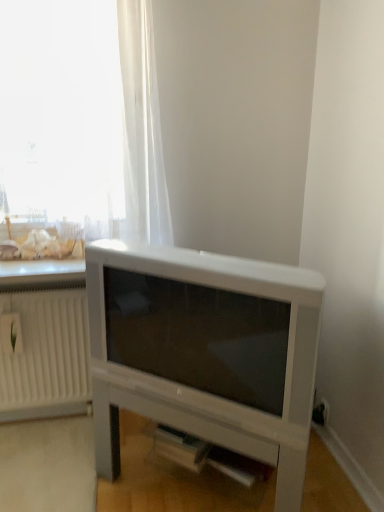
Where is `transparent fabric at upper left`? Image resolution: width=384 pixels, height=512 pixels. transparent fabric at upper left is located at coordinates (62, 113).

The image size is (384, 512). Identify the location of white matte entertainment center at lower center. (205, 352).

From the image's perspective, does white plastic radiator at left appear lower than transparent fabric at upper left?

Yes, from the image's perspective, white plastic radiator at left is beneath transparent fabric at upper left.

From a real-world perspective, is white plastic radiator at left on top of transparent fabric at upper left?

Actually, white plastic radiator at left is physically below transparent fabric at upper left in the real world.

Considering the positions of objects white plastic radiator at left and transparent fabric at upper left in the image provided, who is more to the right, white plastic radiator at left or transparent fabric at upper left?

transparent fabric at upper left.

Is white plastic radiator at left not close to transparent fabric at upper left?

No.

Can you tell me how much white plastic radiator at left and white matte entertainment center at lower center differ in facing direction?

37.5 degrees.

Is white plastic radiator at left closer to the viewer compared to white matte entertainment center at lower center?

No, the depth of white plastic radiator at left is greater than that of white matte entertainment center at lower center.

Is white plastic radiator at left taller than white matte entertainment center at lower center?

Correct, white plastic radiator at left is much taller as white matte entertainment center at lower center.

Is white plastic radiator at left to the right of white matte entertainment center at lower center from the viewer's perspective?

Incorrect, white plastic radiator at left is not on the right side of white matte entertainment center at lower center.

Would you say white matte entertainment center at lower center is outside white plastic radiator at left?

Yes.

Does point (120, 344) lie behind point (81, 411)?

No, (120, 344) is in front of (81, 411).

Would you say white matte entertainment center at lower center is a long distance from white plastic radiator at left?

No, white matte entertainment center at lower center is not far away from white plastic radiator at left.

Is transparent fabric at upper left to the left of white matte entertainment center at lower center from the viewer's perspective?

Yes, transparent fabric at upper left is to the left of white matte entertainment center at lower center.

How different are the orientations of transparent fabric at upper left and white matte entertainment center at lower center in degrees?

38.8 degrees separate the facing orientations of transparent fabric at upper left and white matte entertainment center at lower center.

Which is closer, [92,69] or [282,431]?

Clearly, point [92,69] is more distant from the camera than point [282,431].

Considering the relative positions of transparent fabric at upper left and white matte entertainment center at lower center in the image provided, is transparent fabric at upper left in front of white matte entertainment center at lower center?

No, the depth of transparent fabric at upper left is greater than that of white matte entertainment center at lower center.

Considering the relative positions of white matte entertainment center at lower center and transparent fabric at upper left in the image provided, is white matte entertainment center at lower center in front of transparent fabric at upper left?

Yes, it is in front of transparent fabric at upper left.

Choose the correct answer: Is white matte entertainment center at lower center inside transparent fabric at upper left or outside it?

The correct answer is: outside.

Between white matte entertainment center at lower center and transparent fabric at upper left, which one has smaller size?

transparent fabric at upper left is smaller.

Which of these two, transparent fabric at upper left or white plastic radiator at left, is wider?

Wider between the two is transparent fabric at upper left.

From the image's perspective, does transparent fabric at upper left appear higher than white plastic radiator at left?

Yes, from the image's perspective, transparent fabric at upper left is above white plastic radiator at left.

The width and height of the screenshot is (384, 512). What are the coordinates of `window that appears above the white plastic radiator at left (from the image's perspective)` in the screenshot? It's located at (62, 113).

Are transparent fabric at upper left and white plastic radiator at left located far from each other?

Actually, transparent fabric at upper left and white plastic radiator at left are a little close together.

The width and height of the screenshot is (384, 512). Find the location of `radiator located below the transparent fabric at upper left (from the image's perspective)`. radiator located below the transparent fabric at upper left (from the image's perspective) is located at coordinates (45, 354).

You are a GUI agent. You are given a task and a screenshot of the screen. Output one action in this format:
    pyautogui.click(x=<x>, y=<y>)
    Task: Click on the entertainment center below the white plastic radiator at left (from a real-world perspective)
    Image resolution: width=384 pixels, height=512 pixels.
    Given the screenshot: What is the action you would take?
    pyautogui.click(x=205, y=352)

Estimate the real-world distances between objects in this image. Which object is further from transparent fabric at upper left, white plastic radiator at left or white matte entertainment center at lower center?

Among the two, white plastic radiator at left is located further to transparent fabric at upper left.

From the picture: Which object lies nearer to the anchor point white plastic radiator at left, transparent fabric at upper left or white matte entertainment center at lower center?

Among the two, white matte entertainment center at lower center is located nearer to white plastic radiator at left.

Based on their spatial positions, is white matte entertainment center at lower center or transparent fabric at upper left closer to white plastic radiator at left?

white matte entertainment center at lower center is positioned closer to the anchor white plastic radiator at left.

Estimate the real-world distances between objects in this image. Which object is closer to transparent fabric at upper left, white matte entertainment center at lower center or white plastic radiator at left?

The object closer to transparent fabric at upper left is white matte entertainment center at lower center.

Considering their positions, is white plastic radiator at left positioned closer to white matte entertainment center at lower center than transparent fabric at upper left?

white plastic radiator at left.

Estimate the real-world distances between objects in this image. Which object is further from white matte entertainment center at lower center, transparent fabric at upper left or white plastic radiator at left?

Based on the image, transparent fabric at upper left appears to be further to white matte entertainment center at lower center.

The image size is (384, 512). I want to click on radiator that lies between transparent fabric at upper left and white matte entertainment center at lower center from top to bottom, so click(45, 354).